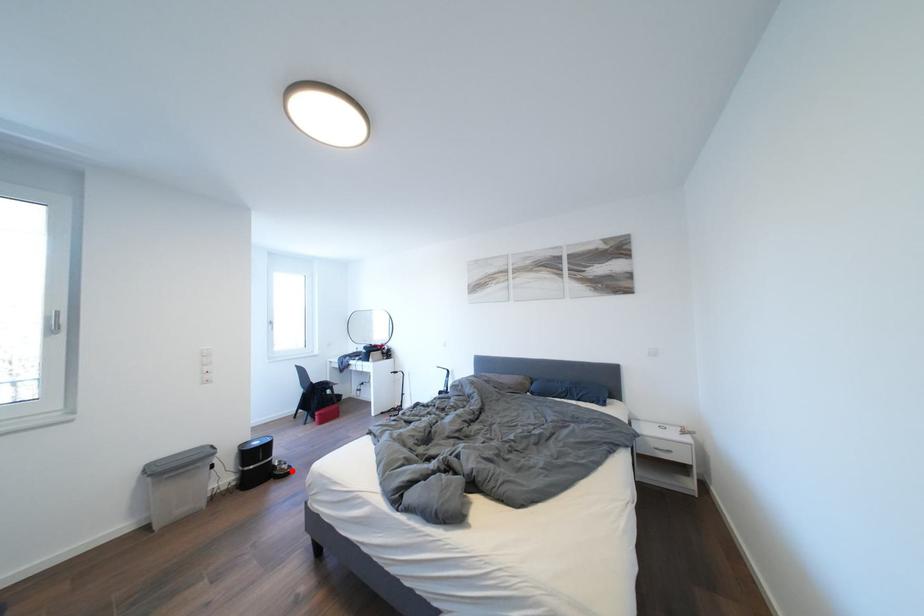
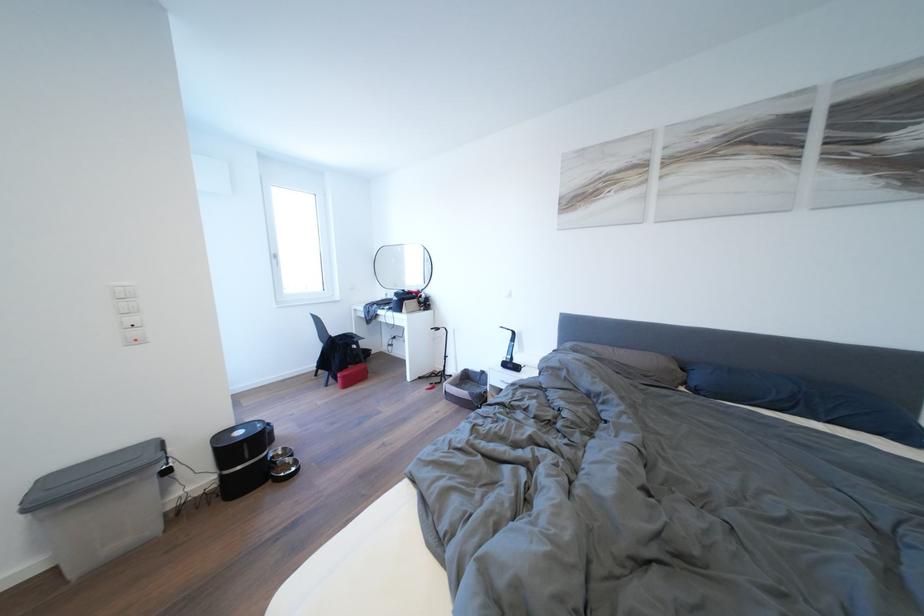
The point at the highlighted location is marked in the first image. Where is the corresponding point in the second image?

(296, 466)